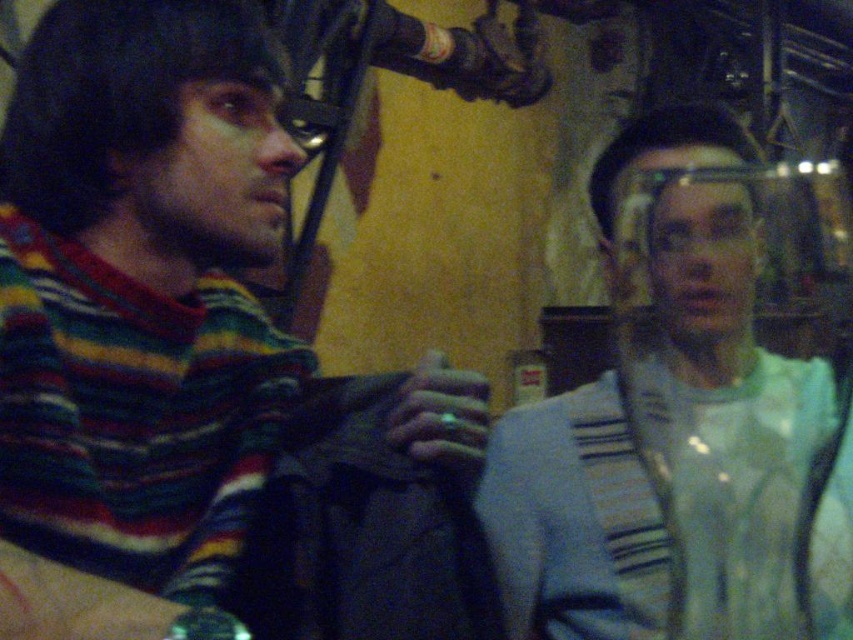
You are a photographer at this event and want to capture both the striped wool sweater at left and the light blue fabric at right in the same frame. Your camera has a maximum focus range of 9 inches. Can you fit both subjects within the camera frame without moving closer?

The distance between the striped wool sweater at left and the light blue fabric at right is 9.36 inches. Since the camera can only focus within 9 inches, the subjects are slightly out of range. Move closer to reduce the distance between them in the frame.

You are at the center of the image. Which direction should you move to reach the striped wool sweater at left?

The striped wool sweater at left is located at point 0.553 on the x axis and 0.240 on the y axis. Since you are at the center of the image, which is point 0.5 on both axes, you should move slightly to the right on the x axis and slightly down on the y axis to reach it.